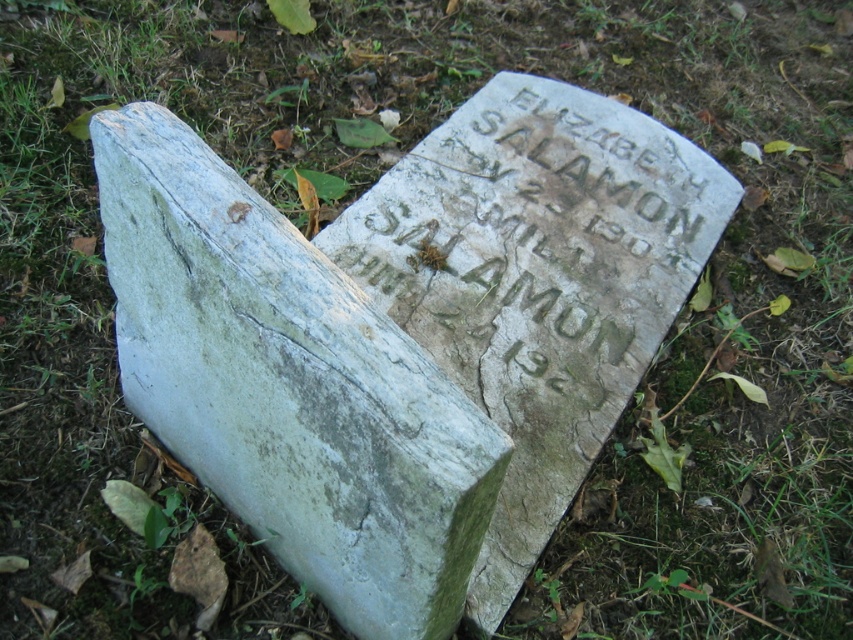
You are standing in front of the weathered stone marker in the cemetery. You notice two points marked on the marker. The first point is at coordinates point [354,340] and the second point is at point [624,192]. Which of these two points is closer to you?

Point [354,340] is closer to the camera than point [624,192], so the first point is closer to you.

You are standing in a cemetery and see the white stone gravestone at center and the carved stone inscription at center. Which object is physically closer to you?

The white stone gravestone at center is closer to the viewer than the carved stone inscription at center.